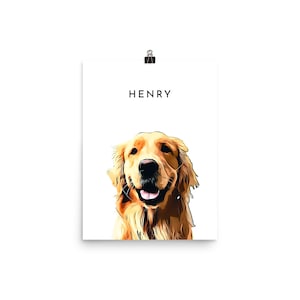
You are a GUI agent. You are given a task and a screenshot of the screen. Output one action in this format:
    pyautogui.click(x=<x>, y=<y>)
    Task: Click on the shadowy space under picture
    The height and width of the screenshot is (300, 300).
    Given the screenshot: What is the action you would take?
    pyautogui.click(x=82, y=241), pyautogui.click(x=206, y=241), pyautogui.click(x=101, y=239)